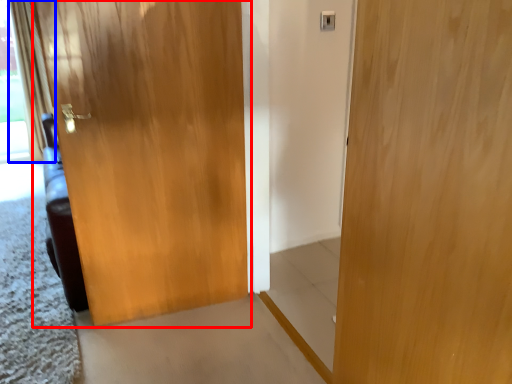
Question: Which object appears farthest to the camera in this image, door (highlighted by a red box) or curtain (highlighted by a blue box)?

Choices:
 (A) door
 (B) curtain

Answer: (B)